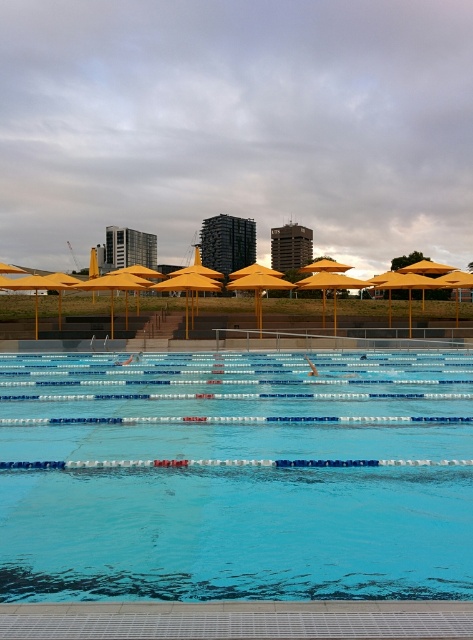
Between point (395, 538) and point (314, 300), which one is positioned behind?

Point (314, 300)

Can you confirm if clear blue water at center is taller than yellow matte umbrella at center?

No, clear blue water at center is not taller than yellow matte umbrella at center.

This screenshot has width=473, height=640. What do you see at coordinates (236, 476) in the screenshot?
I see `clear blue water at center` at bounding box center [236, 476].

The height and width of the screenshot is (640, 473). Identify the location of clear blue water at center. (236, 476).